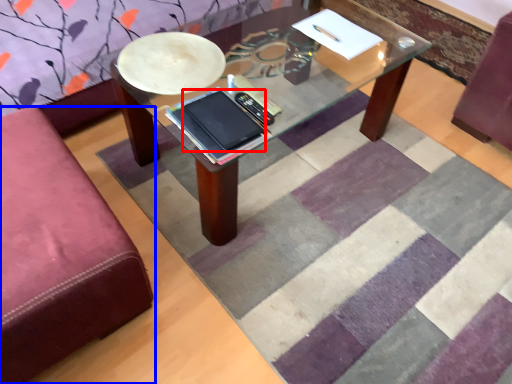
Question: Among these objects, which one is nearest to the camera, tablet computer (highlighted by a red box) or studio couch (highlighted by a blue box)?

Choices:
 (A) tablet computer
 (B) studio couch

Answer: (B)